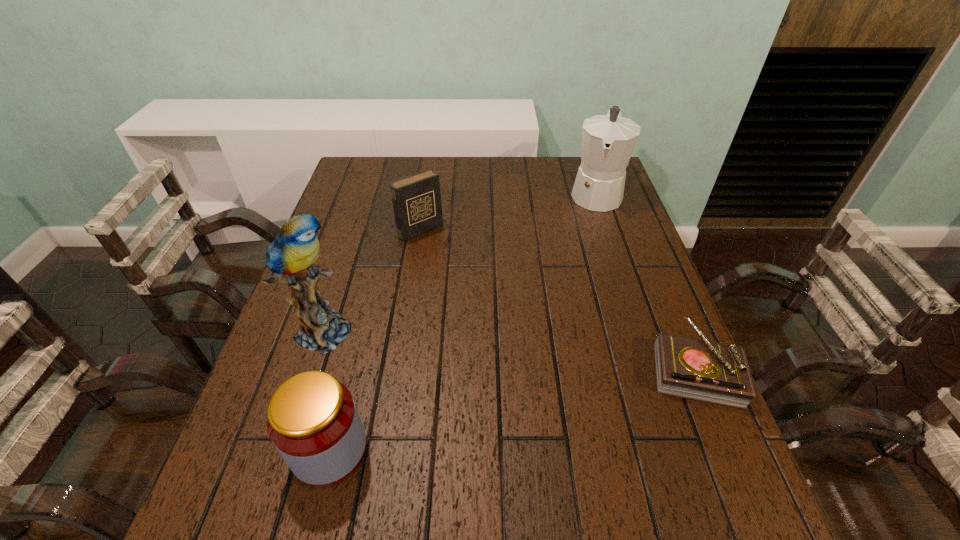
Find the location of a particular element. This screenshot has height=540, width=960. vacant space on the desktop that is between the nearest object and the shortest object and is positioned on the face of the tallest object is located at coordinates (575, 395).

At what (x,y) coordinates should I click in order to perform the action: click on vacant space on the desktop that is between the nearest object and the right diary and is positioned at the spout of the fourth shortest object. Please return your answer as a coordinate pair (x, y). This screenshot has width=960, height=540. Looking at the image, I should click on (549, 401).

At what (x,y) coordinates should I click in order to perform the action: click on vacant space on the desktop that is between the jar and the shortest object and is positioned on the front cover of the left diary. Please return your answer as a coordinate pair (x, y). The width and height of the screenshot is (960, 540). Looking at the image, I should click on [x=577, y=395].